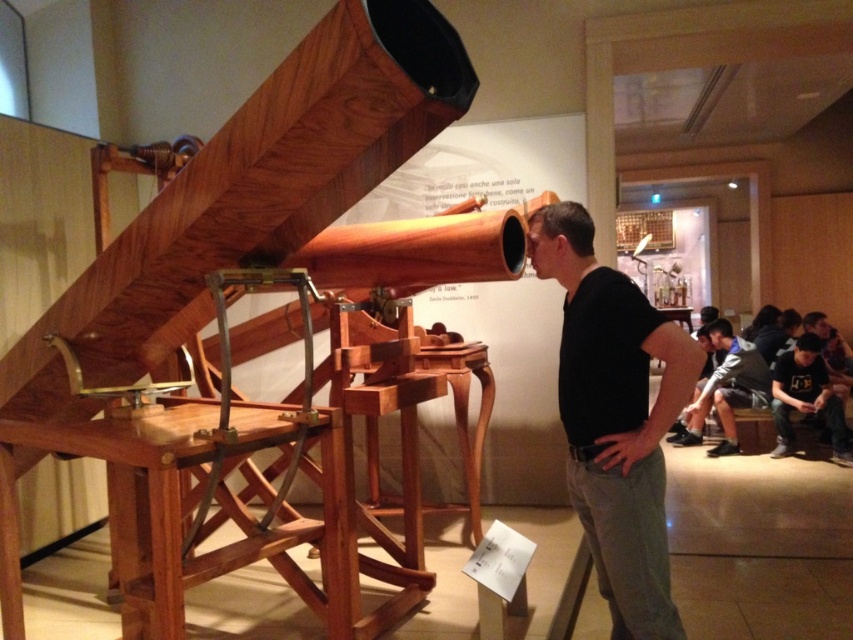
Question: Among these objects, which one is nearest to the camera?

Choices:
 (A) black matte shirt at center
 (B) dark gray shirt at lower right

Answer: (A)

Question: Does black matte shirt at center have a larger size compared to dark gray fabric jacket at center?

Choices:
 (A) no
 (B) yes

Answer: (A)

Question: Among these points, which one is nearest to the camera?

Choices:
 (A) (662, 490)
 (B) (790, 401)

Answer: (A)

Question: Estimate the real-world distances between objects in this image. Which object is farther from the dark gray fabric jacket at center?

Choices:
 (A) gray fabric jacket at lower right
 (B) dark gray shirt at lower right

Answer: (A)

Question: Does black matte shirt at center appear on the left side of dark gray fabric jacket at center?

Choices:
 (A) yes
 (B) no

Answer: (A)

Question: Where is black matte shirt at center located in relation to gray fabric jacket at lower right in the image?

Choices:
 (A) right
 (B) left

Answer: (B)